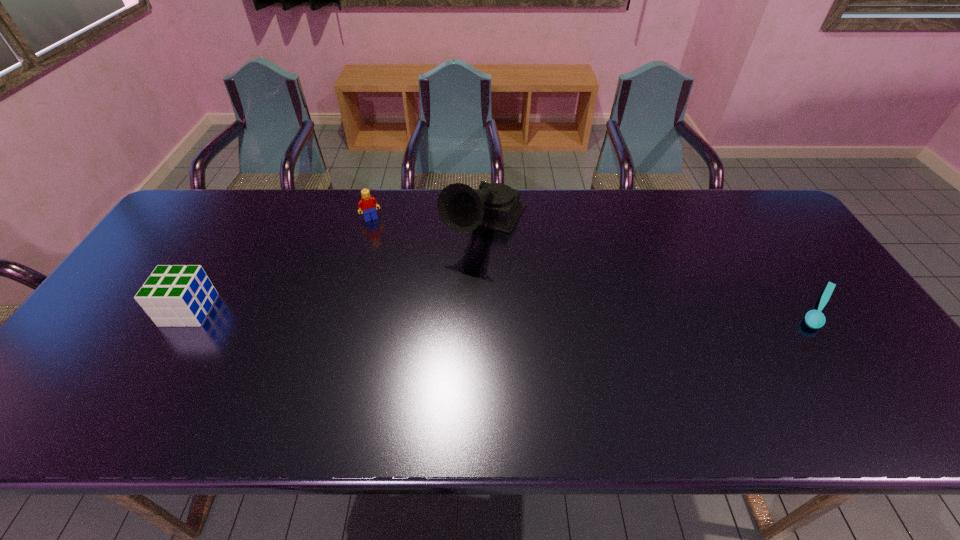
The height and width of the screenshot is (540, 960). I want to click on cube, so click(178, 295).

The width and height of the screenshot is (960, 540). Find the location of `spoon`. spoon is located at coordinates pos(815,319).

Identify the location of the rightmost object. This screenshot has width=960, height=540. (815, 319).

Identify the location of phonograph_record. The width and height of the screenshot is (960, 540). (461, 208).

Find the location of a particular element. the tallest object is located at coordinates (461, 208).

Locate an element on the screen. Lego is located at coordinates (368, 204).

At what (x,y) coordinates should I click in order to perform the action: click on free space located on the red face of the leftmost object. Please return your answer as a coordinate pair (x, y). The height and width of the screenshot is (540, 960). Looking at the image, I should click on pyautogui.click(x=118, y=310).

Where is `blank area located on the back of the spoon`? The height and width of the screenshot is (540, 960). blank area located on the back of the spoon is located at coordinates (770, 238).

Image resolution: width=960 pixels, height=540 pixels. What are the coordinates of `free location located 0.110m from the horn of the phonograph_record` in the screenshot? It's located at (452, 288).

This screenshot has width=960, height=540. Identify the location of vacant space located 0.070m from the horn of the phonograph_record. (458, 279).